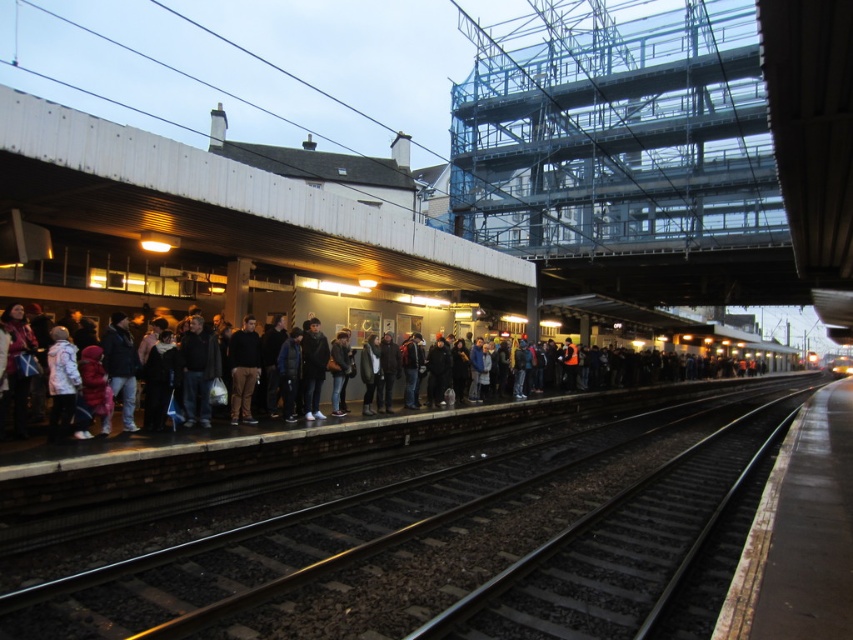
Is point (502, 390) positioned after point (848, 371)?

No, (502, 390) is closer to viewer.

Who is more forward, (230, 336) or (846, 364)?

Point (230, 336) is in front.

The height and width of the screenshot is (640, 853). Identify the location of dark gray jacket at left. (619, 369).

Does point (358, 552) come in front of point (465, 372)?

Yes.

Between black metal track at center and dark gray jacket at left, which one has less height?

black metal track at center is shorter.

Where is `black metal track at center`? Image resolution: width=853 pixels, height=640 pixels. black metal track at center is located at coordinates (445, 541).

Which is below, black metal track at center or yellow metallic train at center?

yellow metallic train at center is below.

Is black metal track at center positioned behind yellow metallic train at center?

No, it is not.

Does point (537, 468) lie behind point (843, 368)?

No, it is not.

Where is `black metal track at center`? black metal track at center is located at coordinates (445, 541).